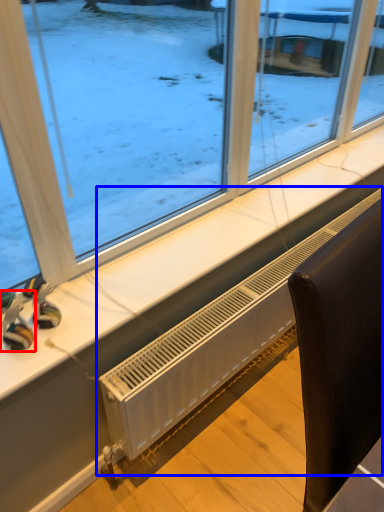
Question: Which of the following is the farthest to the observer, toy (highlighted by a red box) or air conditioning (highlighted by a blue box)?

Choices:
 (A) toy
 (B) air conditioning

Answer: (B)